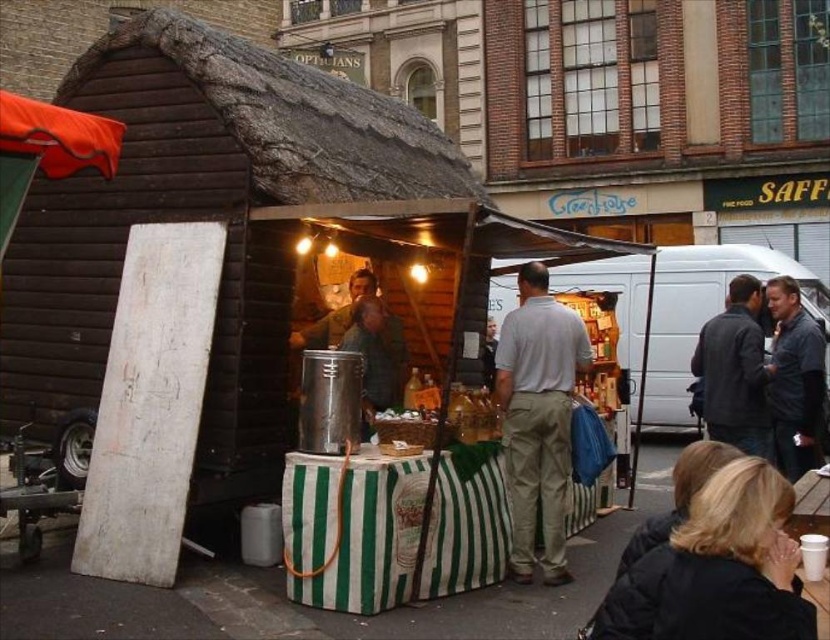
Does black jacket at lower right lie in front of light gray cotton polo shirt at center?

That is True.

Is black jacket at lower right thinner than light gray cotton polo shirt at center?

Incorrect, black jacket at lower right's width is not less than light gray cotton polo shirt at center's.

Is point (763, 518) closer to camera compared to point (547, 557)?

Yes, point (763, 518) is in front of point (547, 557).

This screenshot has height=640, width=830. Find the location of `black jacket at lower right`. black jacket at lower right is located at coordinates (716, 568).

Between point (721, 605) and point (508, 305), which one is positioned behind?

Point (508, 305)

Is black jacket at lower right positioned in front of matte silver food truck at center?

Yes, black jacket at lower right is closer to the viewer.

At what (x,y) coordinates should I click in order to perform the action: click on black jacket at lower right. Please return your answer as a coordinate pair (x, y). The width and height of the screenshot is (830, 640). Looking at the image, I should click on (716, 568).

Can you confirm if black jacket at lower right is thinner than dark blue jacket at lower right?

No.

Is point (670, 618) less distant than point (814, 412)?

Yes, point (670, 618) is closer to viewer.

Find the location of a particular element. black jacket at lower right is located at coordinates (716, 568).